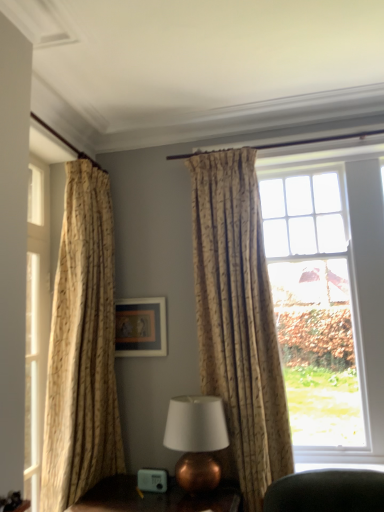
Describe the element at coordinates (154, 498) in the screenshot. I see `copper metallic table lamp at lower center` at that location.

In order to click on beige textured curtain at left, marked as the 1th curtain in a left-to-right arrangement in this screenshot , I will do `click(82, 347)`.

In order to face beige textured curtain at left, marked as the 1th curtain in a left-to-right arrangement, should I rotate leftwards or rightwards?

To face it directly, rotate left by 15.349 degrees.

Find the location of a particular element. Image resolution: width=384 pixels, height=512 pixels. copper metallic table lamp at center is located at coordinates (196, 440).

This screenshot has height=512, width=384. I want to click on copper metallic table lamp at lower center, so click(154, 498).

Looking at this image, between beige textured curtain at left, the 2th curtain viewed from the right, and copper metallic table lamp at center, which one has larger width?

copper metallic table lamp at center is wider.

In the image, is beige textured curtain at left, the 2th curtain viewed from the right, positioned in front of or behind copper metallic table lamp at center?

beige textured curtain at left, the 2th curtain viewed from the right, is positioned closer to the viewer than copper metallic table lamp at center.

Is beige textured curtain at left, the 2th curtain viewed from the right, taller than copper metallic table lamp at center?

Yes, beige textured curtain at left, the 2th curtain viewed from the right, is taller than copper metallic table lamp at center.

Is beige textured curtain at left, marked as the 1th curtain in a left-to-right arrangement, at the right side of copper metallic table lamp at center?

In fact, beige textured curtain at left, marked as the 1th curtain in a left-to-right arrangement, is to the left of copper metallic table lamp at center.

Which object is positioned more to the left, matte gold picture frame at center or clear glass window at upper right?

From the viewer's perspective, matte gold picture frame at center appears more on the left side.

Is the depth of matte gold picture frame at center less than that of clear glass window at upper right?

No, it is behind clear glass window at upper right.

From the image's perspective, does matte gold picture frame at center appear higher than clear glass window at upper right?

Actually, matte gold picture frame at center appears below clear glass window at upper right in the image.

Which object is closer to the camera, matte gold picture frame at center or copper metallic table lamp at center?

copper metallic table lamp at center.

Which object is positioned more to the left, matte gold picture frame at center or copper metallic table lamp at center?

matte gold picture frame at center is more to the left.

From a real-world perspective, is matte gold picture frame at center above or below copper metallic table lamp at center?

matte gold picture frame at center is above copper metallic table lamp at center.

Considering the relative sizes of matte gold picture frame at center and copper metallic table lamp at center in the image provided, is matte gold picture frame at center smaller than copper metallic table lamp at center?

Correct, matte gold picture frame at center occupies less space than copper metallic table lamp at center.

Does beige textured curtain at center, which is the first curtain from right to left, appear on the left side of copper metallic table lamp at lower center?

No, beige textured curtain at center, which is the first curtain from right to left, is not to the left of copper metallic table lamp at lower center.

From the image's perspective, which is below, beige textured curtain at center, which is the 2th curtain in left-to-right order, or copper metallic table lamp at lower center?

From the image's view, copper metallic table lamp at lower center is below.

Which curtain is the 2nd one when counting from the back of the copper metallic table lamp at lower center? Please provide its 2D coordinates.

[(238, 321)]

Can you confirm if beige textured curtain at center, which is the 2th curtain in left-to-right order, is smaller than copper metallic table lamp at lower center?

No.

Who is bigger, copper metallic table lamp at center or beige textured curtain at left, the 2th curtain viewed from the right?

Bigger between the two is beige textured curtain at left, the 2th curtain viewed from the right.

Locate an element on the screen. The image size is (384, 512). table lamp beneath the beige textured curtain at left, the 2th curtain viewed from the right (from a real-world perspective) is located at coordinates (196, 440).

Considering the positions of objects copper metallic table lamp at center and beige textured curtain at left, marked as the 1th curtain in a left-to-right arrangement, in the image provided, who is more to the left, copper metallic table lamp at center or beige textured curtain at left, marked as the 1th curtain in a left-to-right arrangement,?

Positioned to the left is beige textured curtain at left, marked as the 1th curtain in a left-to-right arrangement.

Considering the relative sizes of copper metallic table lamp at center and beige textured curtain at left, marked as the 1th curtain in a left-to-right arrangement, in the image provided, is copper metallic table lamp at center wider than beige textured curtain at left, marked as the 1th curtain in a left-to-right arrangement,?

Correct, the width of copper metallic table lamp at center exceeds that of beige textured curtain at left, marked as the 1th curtain in a left-to-right arrangement.

Is beige textured curtain at center, which is the 2th curtain in left-to-right order, far from clear glass window at upper right?

No.

Which object is thinner, beige textured curtain at center, which is the first curtain from right to left, or clear glass window at upper right?

beige textured curtain at center, which is the first curtain from right to left, is thinner.

Is beige textured curtain at center, which is the 2th curtain in left-to-right order, positioned beyond the bounds of clear glass window at upper right?

Yes, beige textured curtain at center, which is the 2th curtain in left-to-right order, is not within clear glass window at upper right.

Locate an element on the screen. The height and width of the screenshot is (512, 384). the 1st curtain positioned below the clear glass window at upper right (from a real-world perspective) is located at coordinates (238, 321).

From a real-world perspective, who is located lower, copper metallic table lamp at center or copper metallic table lamp at lower center?

copper metallic table lamp at lower center, from a real-world perspective.

In the image, is copper metallic table lamp at center on the left side or the right side of copper metallic table lamp at lower center?

copper metallic table lamp at center is positioned on copper metallic table lamp at lower center's right side.

In terms of height, does copper metallic table lamp at center look taller or shorter compared to copper metallic table lamp at lower center?

Considering their sizes, copper metallic table lamp at center has more height than copper metallic table lamp at lower center.

In the image, there is a beige textured curtain at left, marked as the 1th curtain in a left-to-right arrangement. At what (x,y) coordinates should I click in order to perform the action: click on table lamp below it (from the image's perspective). Please return your answer as a coordinate pair (x, y). The image size is (384, 512). Looking at the image, I should click on (196, 440).

The width and height of the screenshot is (384, 512). What are the coordinates of `window above the matte gold picture frame at center (from a real-world perspective)` in the screenshot? It's located at (328, 297).

Considering their positions, is clear glass window at upper right positioned further to copper metallic table lamp at center than copper metallic table lamp at lower center?

clear glass window at upper right lies further to copper metallic table lamp at center than the other object.

When comparing their distances from beige textured curtain at left, marked as the 1th curtain in a left-to-right arrangement, does copper metallic table lamp at lower center or beige textured curtain at center, which is the first curtain from right to left, seem further?

Among the two, beige textured curtain at center, which is the first curtain from right to left, is located further to beige textured curtain at left, marked as the 1th curtain in a left-to-right arrangement.

Considering their positions, is copper metallic table lamp at center positioned further to clear glass window at upper right than beige textured curtain at center, which is the 2th curtain in left-to-right order?

copper metallic table lamp at center lies further to clear glass window at upper right than the other object.

From the image, which object appears to be nearer to beige textured curtain at left, the 2th curtain viewed from the right, matte gold picture frame at center or copper metallic table lamp at lower center?

matte gold picture frame at center.

From the image, which object appears to be farther from copper metallic table lamp at lower center, clear glass window at upper right or beige textured curtain at center, which is the first curtain from right to left?

clear glass window at upper right is positioned further to the anchor copper metallic table lamp at lower center.

Looking at the image, which one is located further to beige textured curtain at center, which is the 2th curtain in left-to-right order, clear glass window at upper right or beige textured curtain at left, the 2th curtain viewed from the right?

Among the two, beige textured curtain at left, the 2th curtain viewed from the right, is located further to beige textured curtain at center, which is the 2th curtain in left-to-right order.

From the image, which object appears to be nearer to matte gold picture frame at center, beige textured curtain at center, which is the first curtain from right to left, or copper metallic table lamp at lower center?

beige textured curtain at center, which is the first curtain from right to left, lies closer to matte gold picture frame at center than the other object.

From the image, which object appears to be nearer to clear glass window at upper right, copper metallic table lamp at center or copper metallic table lamp at lower center?

copper metallic table lamp at center is closer to clear glass window at upper right.

The width and height of the screenshot is (384, 512). Identify the location of furniture between beige textured curtain at left, marked as the 1th curtain in a left-to-right arrangement, and clear glass window at upper right, in the horizontal direction. (154, 498).

Where is `picture frame between beige textured curtain at left, marked as the 1th curtain in a left-to-right arrangement, and beige textured curtain at center, which is the 2th curtain in left-to-right order, from left to right`? The height and width of the screenshot is (512, 384). picture frame between beige textured curtain at left, marked as the 1th curtain in a left-to-right arrangement, and beige textured curtain at center, which is the 2th curtain in left-to-right order, from left to right is located at coordinates (141, 327).

Image resolution: width=384 pixels, height=512 pixels. Identify the location of picture frame between beige textured curtain at center, which is the first curtain from right to left, and copper metallic table lamp at lower center from top to bottom. (141, 327).

What are the coordinates of `curtain situated between beige textured curtain at left, marked as the 1th curtain in a left-to-right arrangement, and clear glass window at upper right from left to right` in the screenshot? It's located at (238, 321).